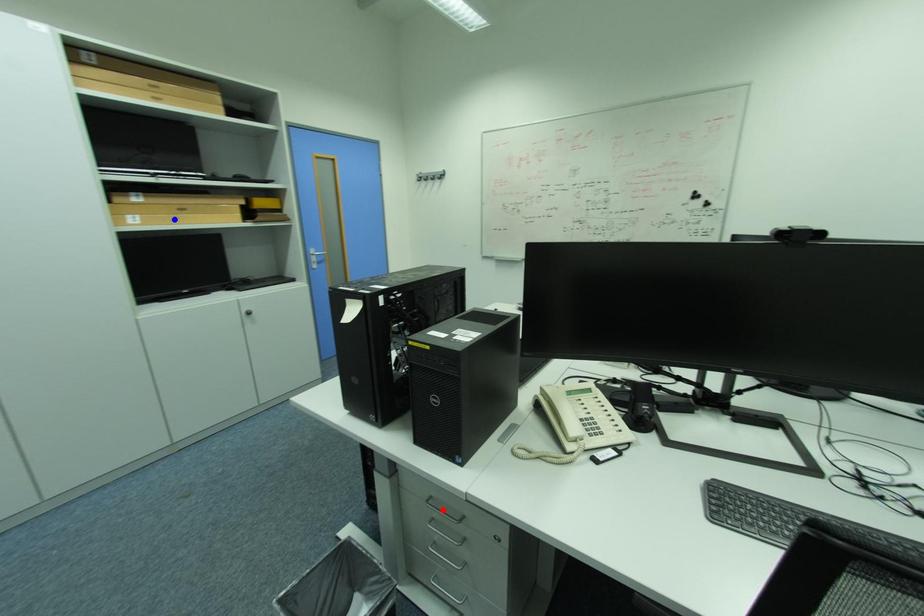
Question: In the image, two points are highlighted. Which point is nearer to the camera? Reply with the corresponding letter.

Choices:
 (A) blue point
 (B) red point

Answer: (B)